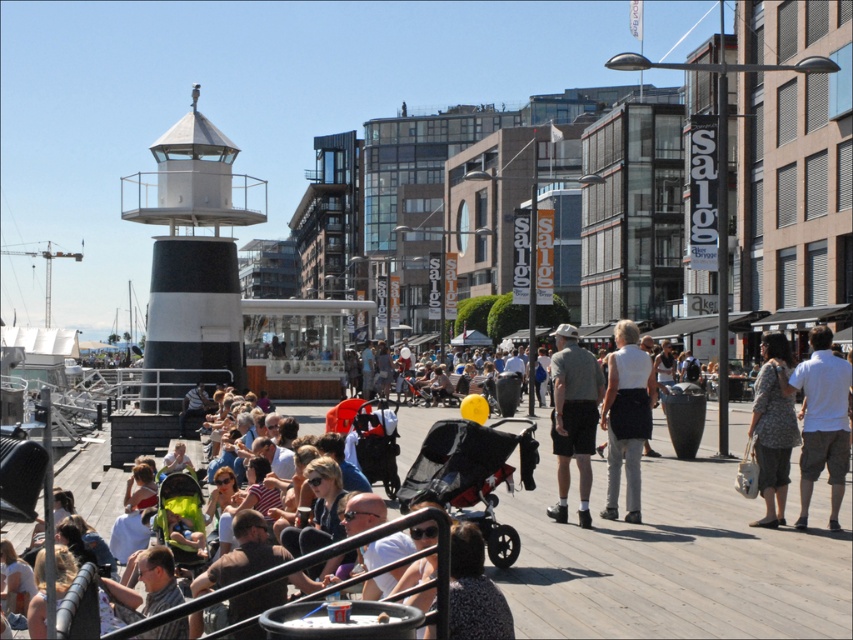
The width and height of the screenshot is (853, 640). Describe the element at coordinates (625, 417) in the screenshot. I see `white matte skirt at center` at that location.

Who is shorter, white matte skirt at center or gray cotton shirt at center?

gray cotton shirt at center

Is point (633, 481) positioned before point (585, 451)?

Yes, point (633, 481) is closer to viewer.

In order to click on white matte skirt at center in this screenshot , I will do point(625,417).

Between white cotton shirt at center and white matte skirt at center, which one is positioned lower?

white matte skirt at center is below.

Does white cotton shirt at center appear under white matte skirt at center?

Incorrect, white cotton shirt at center is not positioned below white matte skirt at center.

Does point (831, 426) come farther from viewer compared to point (601, 515)?

No, (831, 426) is closer to viewer.

Identify the location of white cotton shirt at center. (821, 419).

What do you see at coordinates (772, 429) in the screenshot? This screenshot has width=853, height=640. I see `patterned fabric dress at center` at bounding box center [772, 429].

Can you confirm if patterned fabric dress at center is thinner than matte black stroller at center?

Incorrect, patterned fabric dress at center's width is not less than matte black stroller at center's.

At what (x,y) coordinates should I click in order to perform the action: click on patterned fabric dress at center. Please return your answer as a coordinate pair (x, y). This screenshot has width=853, height=640. Looking at the image, I should click on (772, 429).